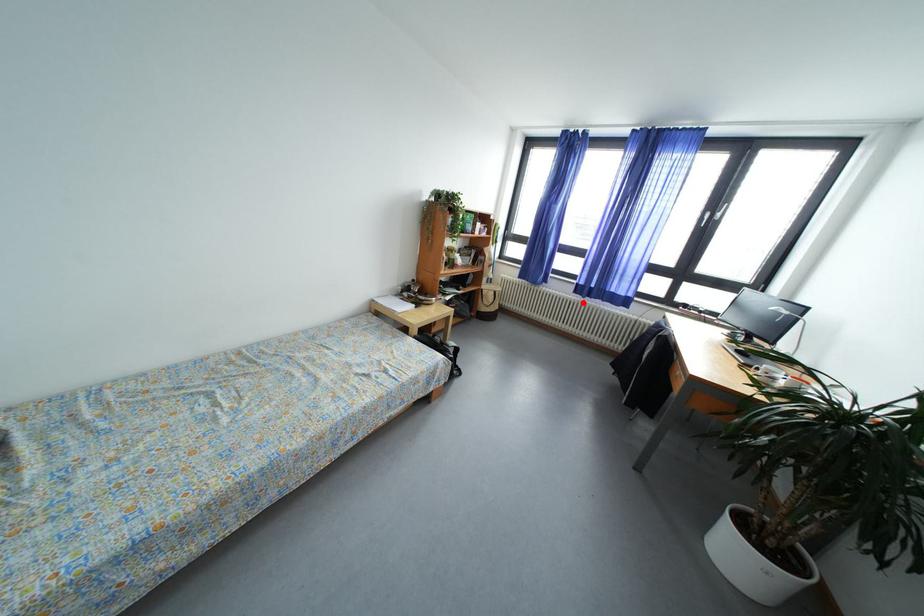
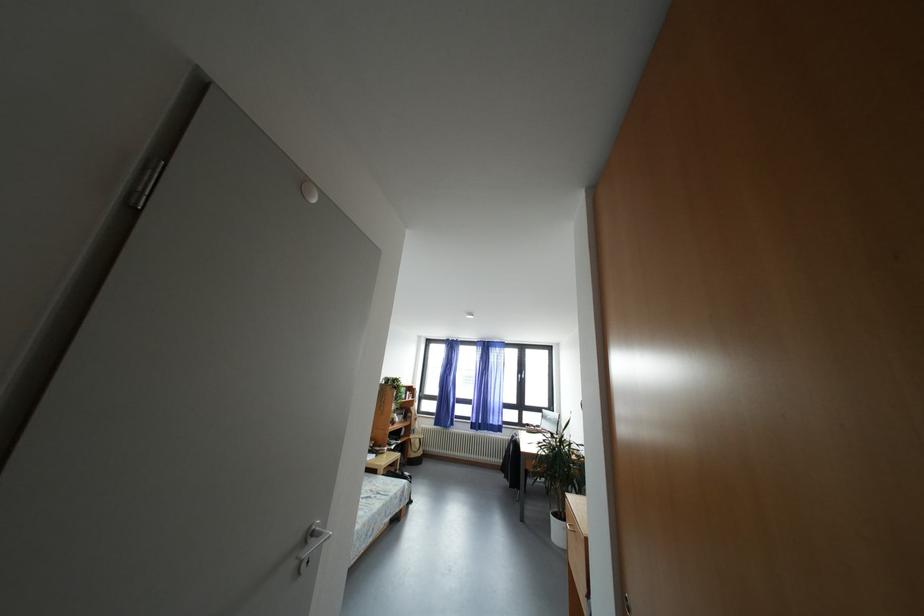
Question: I am providing you with two images of the same scene from different viewpoints. A red point is shown in image1. For the corresponding object point in image2, is it positioned nearer or farther from the camera?

Choices:
 (A) Nearer
 (B) Farther

Answer: (B)